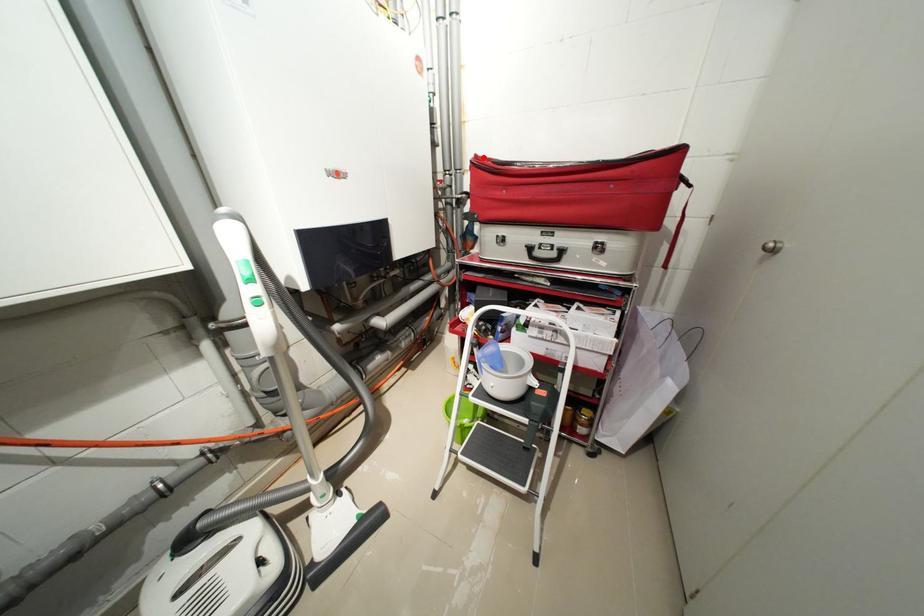
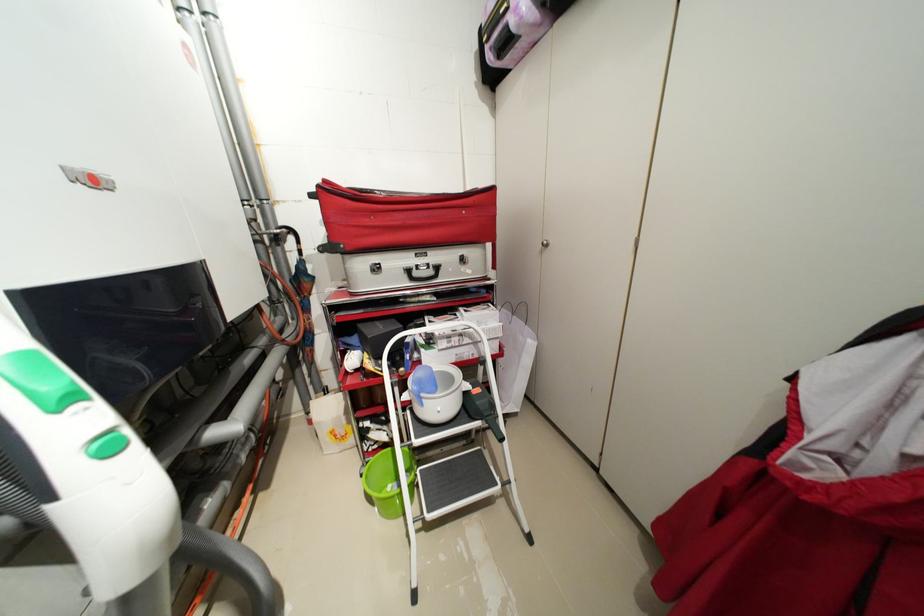
In the second image, find the point that corresponds to the highlighted location in the first image.

(332, 182)